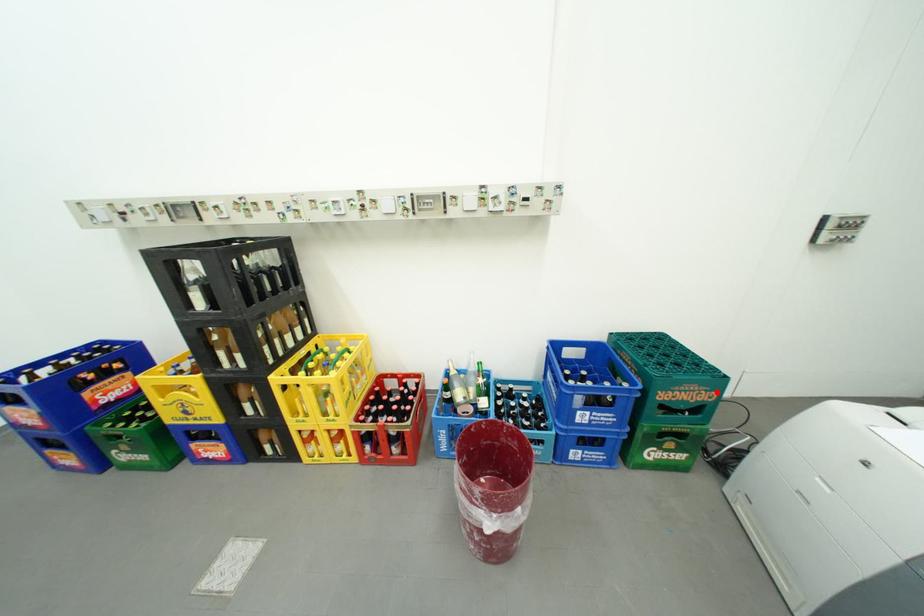
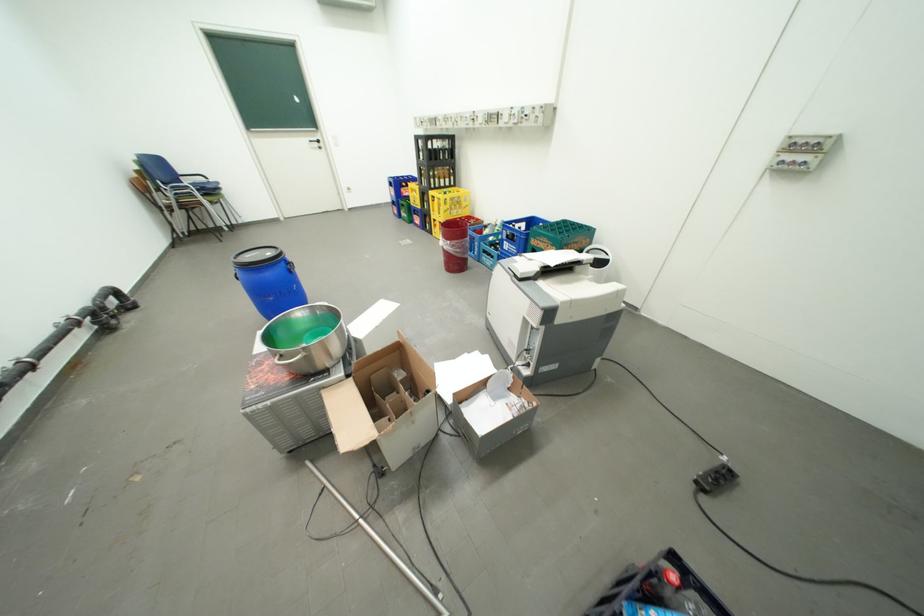
Question: I am providing you with two images of the same scene from different viewpoints. Image1 has a red point marked. In image2, the corresponding 3D location appears at what relative position? Reply with the corresponding letter.

Choices:
 (A) Closer
 (B) Farther

Answer: (B)